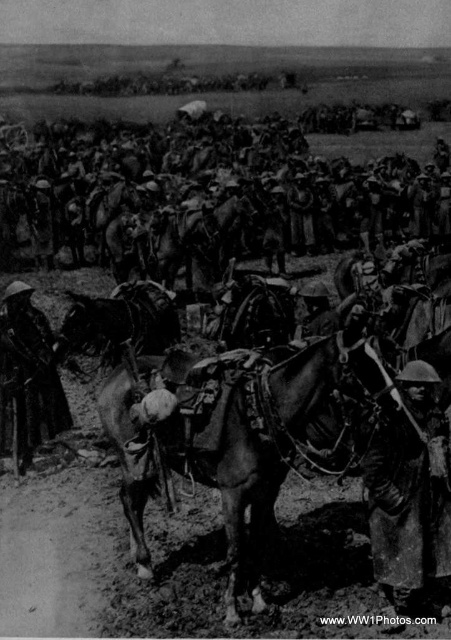
Based on the coordinates provided in the description, where is the dark brown leather horse at center located in the image?

The dark brown leather horse at center is located at point (239, 433) in the image.

You are a soldier in World War I. You need to locate your rifle quickly. Where is your rusty metal rifle at lower right in the image?

The rusty metal rifle at lower right is located at point [410,492] in the image.